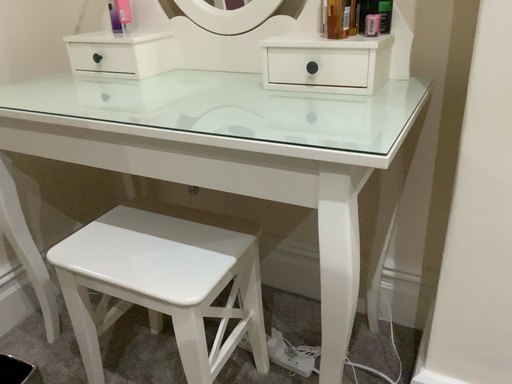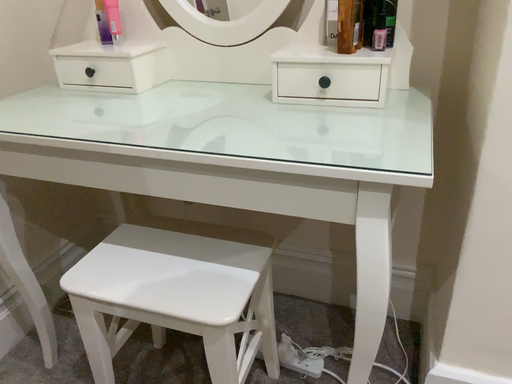
Question: Which way did the camera rotate in the video?

Choices:
 (A) rotated left
 (B) rotated right

Answer: (B)